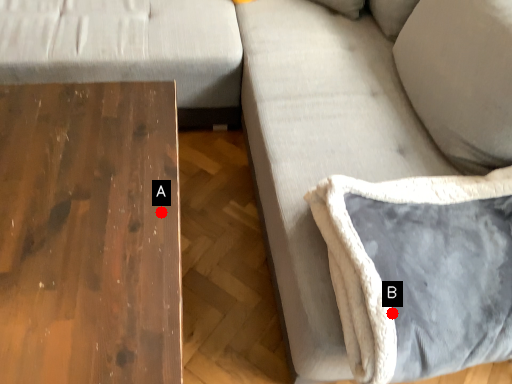
Question: Two points are circled on the image, labeled by A and B beside each circle. Which point is farther to the camera?

Choices:
 (A) A is further
 (B) B is further

Answer: (A)